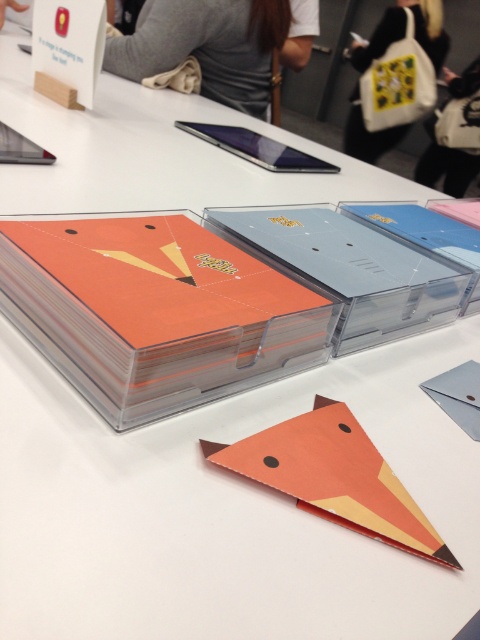
Question: Which object is closer to the camera taking this photo?

Choices:
 (A) white fabric bag at upper center
 (B) orange matte card at center
 (C) transparent plastic box at center
 (D) white fabric bag at upper right

Answer: (B)

Question: Among these points, which one is nearest to the camera?

Choices:
 (A) (478, 156)
 (B) (188, 332)
 (C) (374, 269)
 (D) (389, 131)

Answer: (B)

Question: Does orange matte card at center come in front of white fabric bag at upper center?

Choices:
 (A) no
 (B) yes

Answer: (B)

Question: Which object is closer to the camera taking this photo?

Choices:
 (A) orange matte card at center
 (B) white fabric bag at upper right
 (C) transparent plastic box at center
 (D) white fabric bag at upper center

Answer: (A)

Question: Can you confirm if transparent plastic box at center is wider than white fabric bag at upper center?

Choices:
 (A) no
 (B) yes

Answer: (B)

Question: Does transparent plastic box at center appear under white fabric bag at upper right?

Choices:
 (A) yes
 (B) no

Answer: (A)